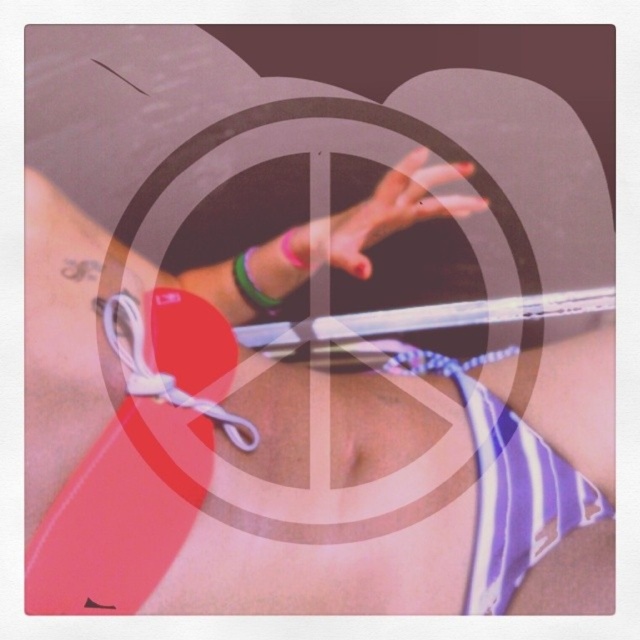
Based on the photo, you are a personal trainer observing a client at the beach who is lifting a barbell. The client has two green rubber bracelets. Where is the green rubber bracelet at center in relation to the green rubber bracelet at upper center?

The green rubber bracelet at center is located below the green rubber bracelet at upper center.

You are a fitness instructor observing a participant at a beach workout session. The participant is holding a barbell with two accessories on their wrist. Which of the two accessories, the white fabric strap at center or the green rubber bracelet at center, is bigger in size?

The white fabric strap at center has a larger size compared to the green rubber bracelet at center.